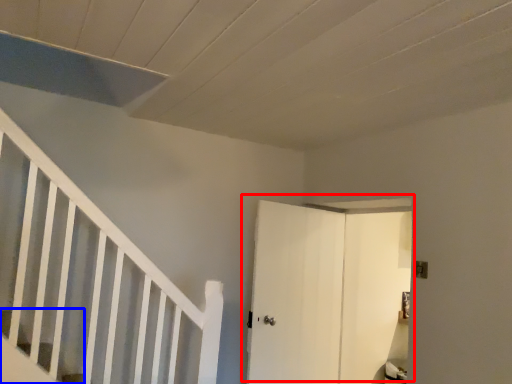
Question: Which object appears closest to the camera in this image, door (highlighted by a red box) or stairs (highlighted by a blue box)?

Choices:
 (A) door
 (B) stairs

Answer: (B)